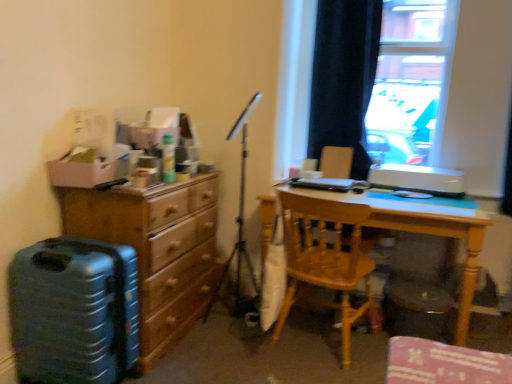
I want to click on vacant space in front of metallic tripod at center, so click(x=220, y=357).